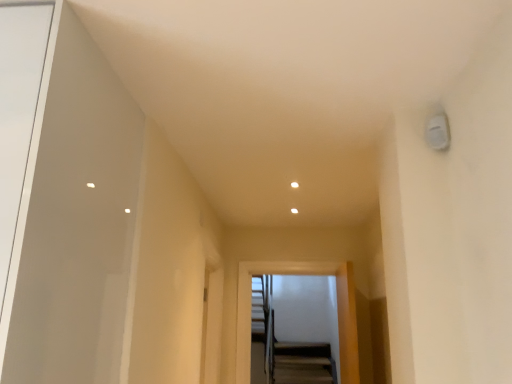
The width and height of the screenshot is (512, 384). I want to click on metallic silver elevator at center, so click(337, 305).

This screenshot has width=512, height=384. What do you see at coordinates (337, 305) in the screenshot?
I see `metallic silver elevator at center` at bounding box center [337, 305].

Image resolution: width=512 pixels, height=384 pixels. In order to click on metallic silver elevator at center in this screenshot , I will do `click(337, 305)`.